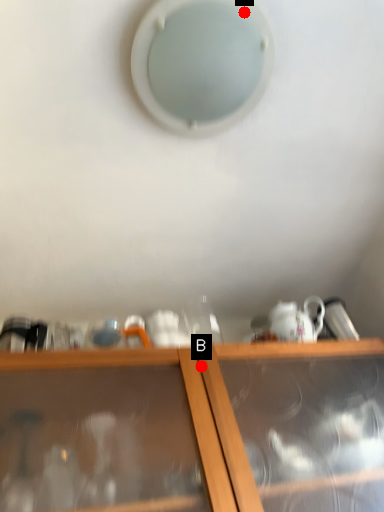
Question: Two points are circled on the image, labeled by A and B beside each circle. Which of the following is the farthest from the observer?

Choices:
 (A) A is further
 (B) B is further

Answer: (B)